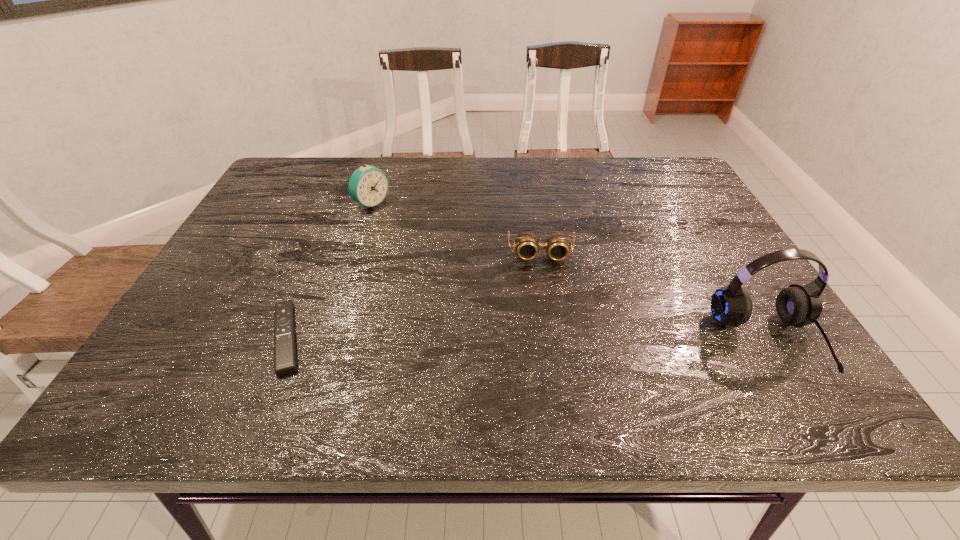
Where is `free space on the desktop that is between the shortest object and the rightmost object and is positioned on the front-facing side of the second tallest object`? free space on the desktop that is between the shortest object and the rightmost object and is positioned on the front-facing side of the second tallest object is located at coordinates (580, 340).

The height and width of the screenshot is (540, 960). Identify the location of free space on the desktop that is between the shortest object and the tallest object and is positioned through the lenses of the second object from right to left. (550, 339).